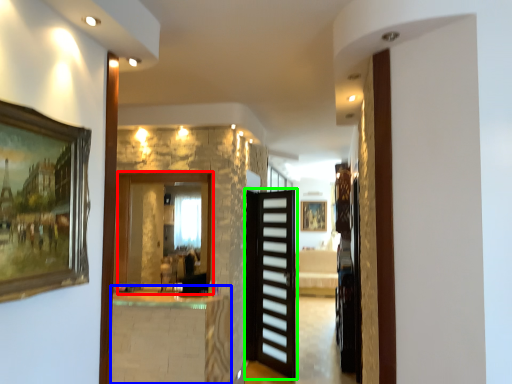
Question: Which object is positioned closest to mirror (highlighted by a red box)? Select from table (highlighted by a blue box) and door (highlighted by a green box).

Choices:
 (A) table
 (B) door

Answer: (A)